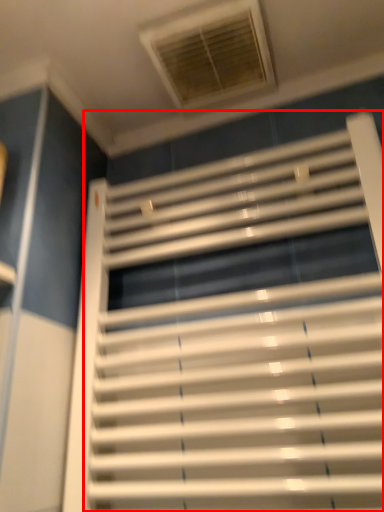
Question: Considering the relative positions of window blind (annotated by the red box) and window in the image provided, where is window blind (annotated by the red box) located with respect to the staircase?

Choices:
 (A) left
 (B) right

Answer: (B)